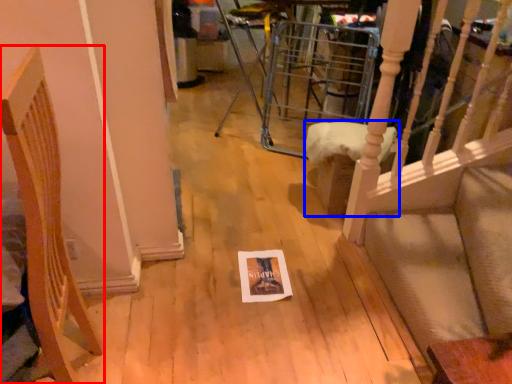
Question: Which object appears closest to the camera in this image, furniture (highlighted by a red box) or furniture (highlighted by a blue box)?

Choices:
 (A) furniture
 (B) furniture

Answer: (A)